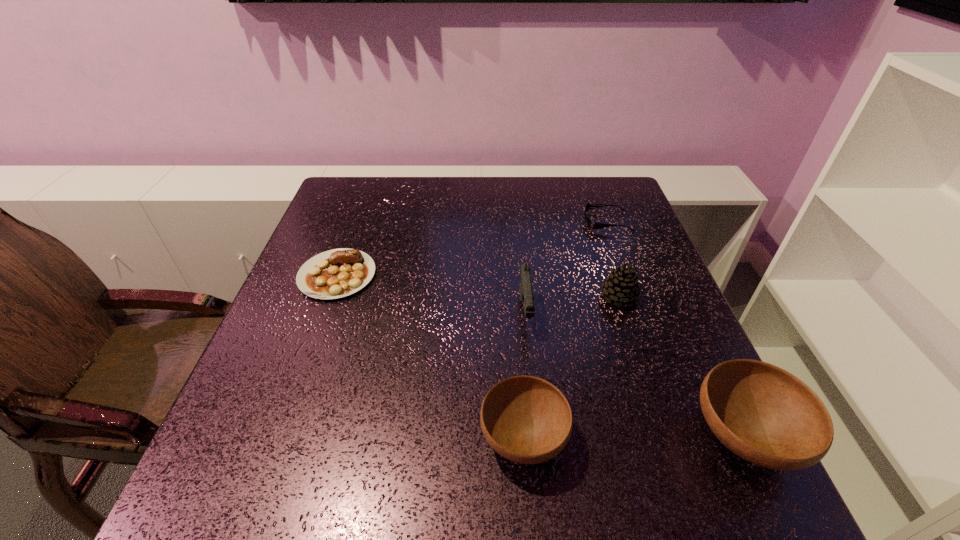
Locate an element on the screen. This screenshot has height=540, width=960. free location located on the left of the right bowl is located at coordinates (590, 437).

The image size is (960, 540). What are the coordinates of `vacant point located on the front-facing side of the farthest object` in the screenshot? It's located at (552, 221).

The image size is (960, 540). I want to click on free space located on the front-facing side of the farthest object, so [514, 221].

Where is `vacant space located 0.150m on the front-facing side of the farthest object`? This screenshot has width=960, height=540. vacant space located 0.150m on the front-facing side of the farthest object is located at coordinates (531, 221).

You are a GUI agent. You are given a task and a screenshot of the screen. Output one action in this format:
    pyautogui.click(x=<x>, y=<y>)
    Task: Click on the free spot located 0.180m at the barrel of the pistol
    
    Given the screenshot: What is the action you would take?
    pyautogui.click(x=536, y=414)

Identify the location of vacant space located on the front of the steak. (305, 363).

The image size is (960, 540). What are the coordinates of `free space located at the narrow end of the pinecone` in the screenshot? It's located at (462, 297).

You are a GUI agent. You are given a task and a screenshot of the screen. Output one action in this format:
    pyautogui.click(x=<x>, y=<y>)
    Task: Click on the vacant space located at the narrow end of the pinecone
    The height and width of the screenshot is (540, 960).
    Given the screenshot: What is the action you would take?
    pyautogui.click(x=466, y=297)

What are the coordinates of `free point located at the narrow end of the pinecone` in the screenshot? It's located at (540, 297).

Where is `object that is positioned at the far edge`? This screenshot has width=960, height=540. object that is positioned at the far edge is located at coordinates click(591, 225).